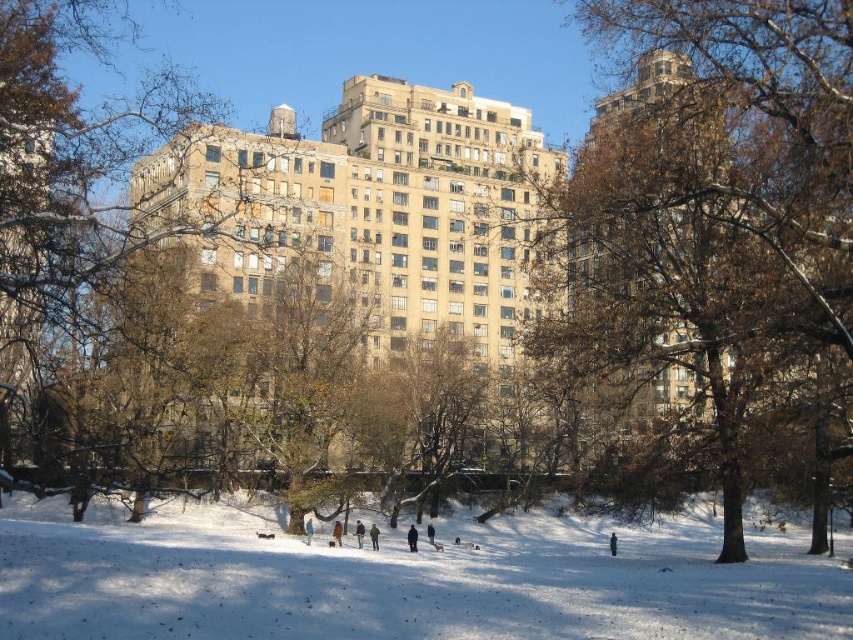
Question: Among these points, which one is farthest from the camera?

Choices:
 (A) (370, 532)
 (B) (799, 51)
 (C) (383, 403)
 (D) (363, 525)

Answer: (C)

Question: Among these objects, which one is farthest from the camera?

Choices:
 (A) brown leafy tree at center
 (B) brown woolen coat at center
 (C) blue denim jacket at lower center

Answer: (B)

Question: Does brown textured tree at center appear over blue denim jacket at lower center?

Choices:
 (A) yes
 (B) no

Answer: (A)

Question: Does brown woolen coat at center have a larger size compared to dark blue jacket at lower center?

Choices:
 (A) no
 (B) yes

Answer: (A)

Question: Which of the following is the farthest from the observer?

Choices:
 (A) (1, 1)
 (B) (412, 376)
 (C) (335, 528)

Answer: (B)

Question: Is white powdery snow at lower center below blue denim jacket at lower center?

Choices:
 (A) yes
 (B) no

Answer: (B)